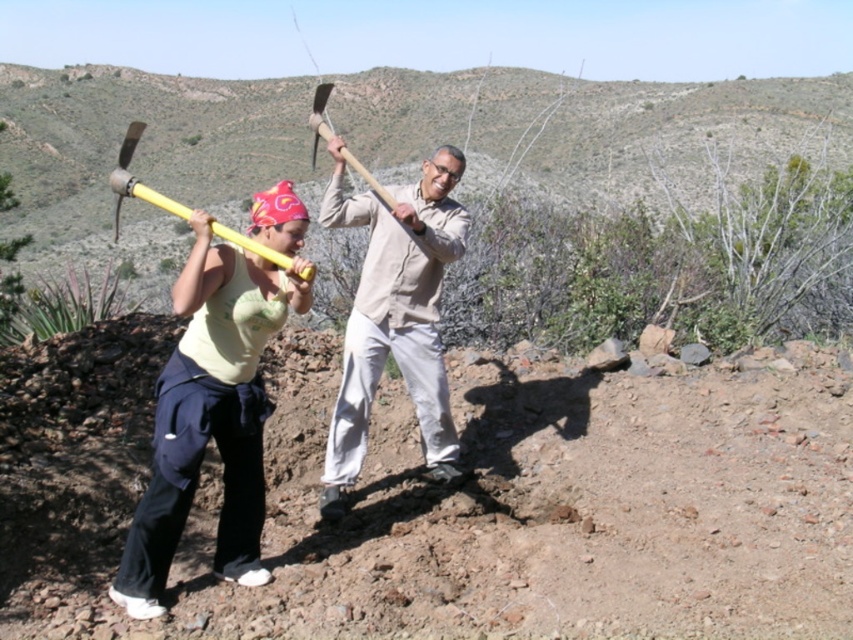
Looking at this image, which of these two, light beige fabric shirt at center or yellow plastic ax at upper center, stands taller?

yellow plastic ax at upper center

Is point (318, 212) in front of point (177, 216)?

That is True.

The width and height of the screenshot is (853, 640). What are the coordinates of `light beige fabric shirt at center` in the screenshot? It's located at (393, 314).

Where is `yellow plastic pickaxe at center`? The width and height of the screenshot is (853, 640). yellow plastic pickaxe at center is located at coordinates (213, 388).

Between yellow plastic pickaxe at center and wooden handle axe at center, which one appears on the right side from the viewer's perspective?

yellow plastic pickaxe at center

Where is `yellow plastic pickaxe at center`? Image resolution: width=853 pixels, height=640 pixels. yellow plastic pickaxe at center is located at coordinates (213, 388).

Which is more to the right, light beige fabric shirt at center or wooden handle axe at center?

From the viewer's perspective, light beige fabric shirt at center appears more on the right side.

Between light beige fabric shirt at center and wooden handle axe at center, which one appears on the left side from the viewer's perspective?

From the viewer's perspective, wooden handle axe at center appears more on the left side.

Does point (373, 396) come in front of point (347, 161)?

No, it is behind (347, 161).

Locate an element on the screen. The width and height of the screenshot is (853, 640). light beige fabric shirt at center is located at coordinates (393, 314).